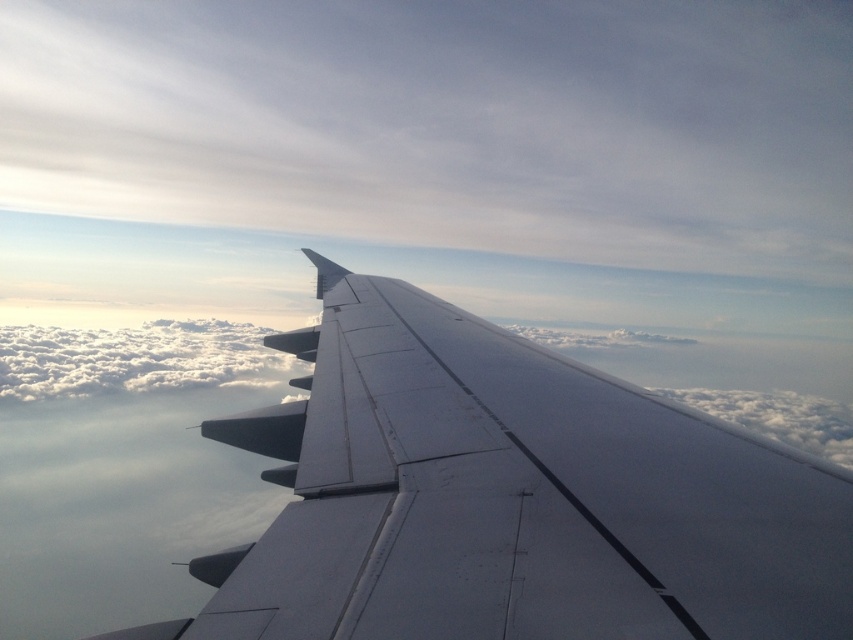
Question: Which of the following is the closest to the observer?

Choices:
 (A) white fluffy cloud at upper right
 (B) white fluffy cloud at upper center
 (C) metallic gray wing at center
 (D) white fluffy cloud at center

Answer: (C)

Question: Does metallic gray wing at center have a lesser width compared to white fluffy cloud at center?

Choices:
 (A) no
 (B) yes

Answer: (B)

Question: Does white fluffy cloud at upper center appear on the right side of white fluffy cloud at center?

Choices:
 (A) yes
 (B) no

Answer: (A)

Question: Which point is farther to the camera?

Choices:
 (A) (837, 596)
 (B) (791, 212)

Answer: (B)

Question: Is white fluffy cloud at upper center to the right of metallic gray wing at center from the viewer's perspective?

Choices:
 (A) no
 (B) yes

Answer: (A)

Question: Which point is closer to the camera taking this photo?

Choices:
 (A) (804, 428)
 (B) (625, 186)
 (C) (106, 372)
 (D) (465, 316)

Answer: (D)